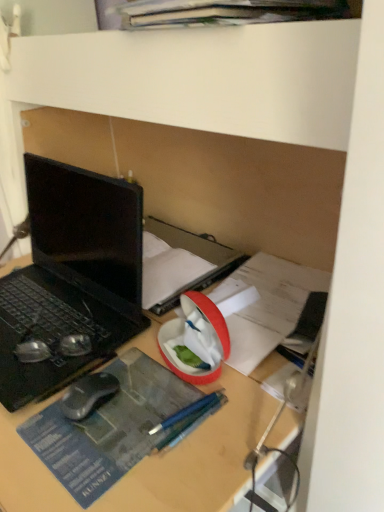
You are a GUI agent. You are given a task and a screenshot of the screen. Output one action in this format:
    pyautogui.click(x=<x>, y=<y>)
    Task: Click on the free point to the left of metallic blue pencil at center
    This screenshot has height=512, width=384.
    Given the screenshot: What is the action you would take?
    pyautogui.click(x=101, y=434)